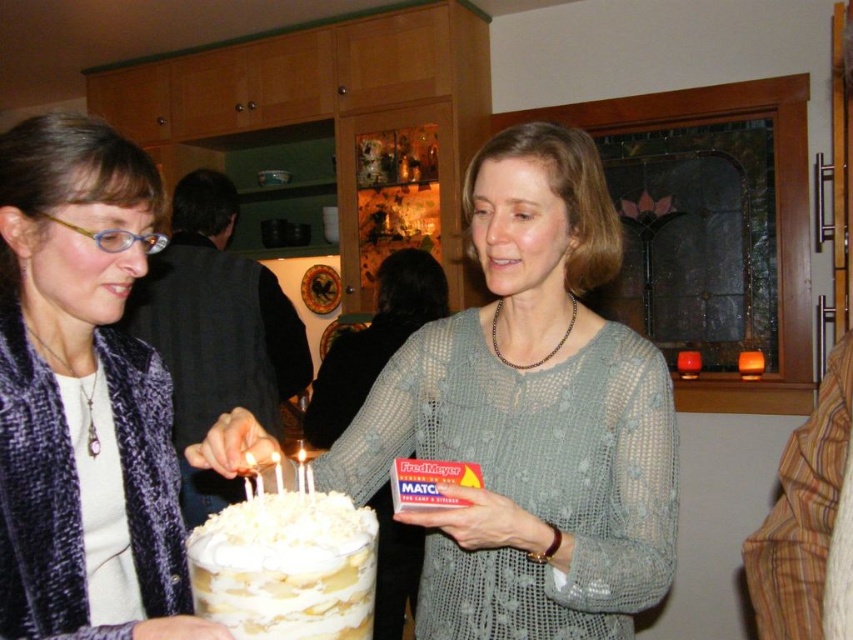
Is point (264, 602) less distant than point (395, 264)?

Yes, point (264, 602) is closer to viewer.

I want to click on white fluffy cake at center, so click(x=286, y=566).

Is purple textured jacket at lower left below knitted gray sweater at center?

Actually, purple textured jacket at lower left is above knitted gray sweater at center.

Where is `purple textured jacket at lower left`? The image size is (853, 640). purple textured jacket at lower left is located at coordinates (82, 394).

The height and width of the screenshot is (640, 853). I want to click on purple textured jacket at lower left, so click(x=82, y=394).

Can you confirm if purple textured jacket at lower left is positioned to the right of white fluffy cake at center?

Incorrect, purple textured jacket at lower left is not on the right side of white fluffy cake at center.

Which is above, purple textured jacket at lower left or white fluffy cake at center?

purple textured jacket at lower left

Who is more forward, (28, 196) or (289, 625)?

Point (289, 625) is more forward.

This screenshot has height=640, width=853. I want to click on purple textured jacket at lower left, so click(x=82, y=394).